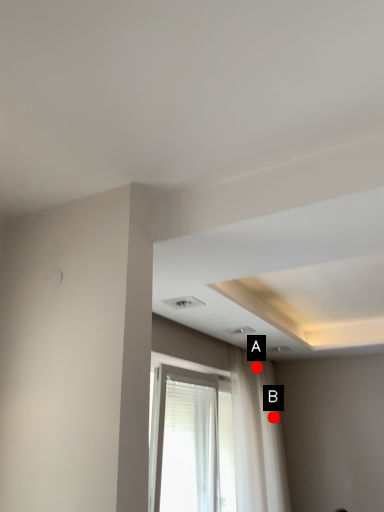
Question: Two points are circled on the image, labeled by A and B beside each circle. Which of the following is the closest to the observer?

Choices:
 (A) A is closer
 (B) B is closer

Answer: (B)